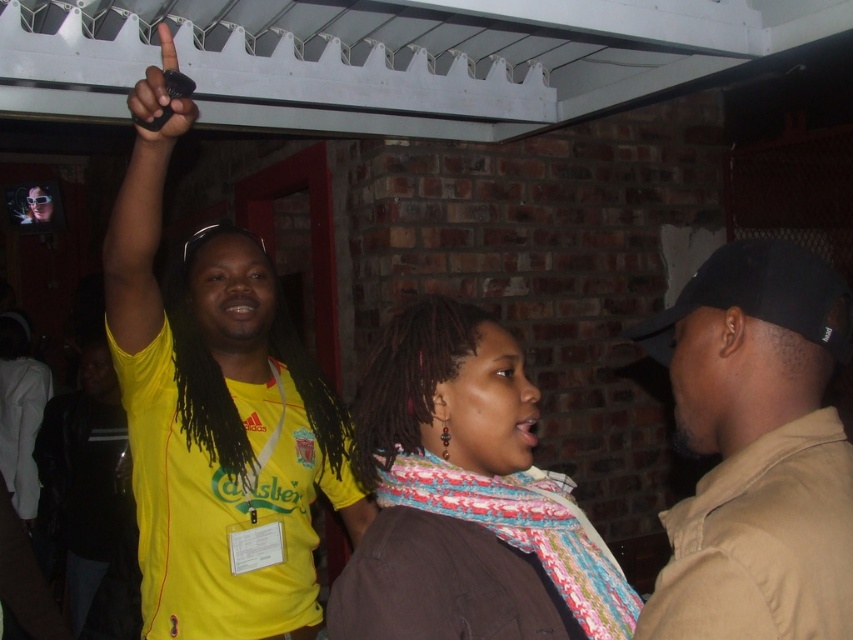
Question: Observing the image, what is the correct spatial positioning of black cotton cap at upper right in reference to black matte phone at upper left?

Choices:
 (A) left
 (B) right

Answer: (B)

Question: Which of the following is the farthest from the observer?

Choices:
 (A) (825, 460)
 (B) (175, 80)
 (C) (471, 369)
 (D) (283, 317)

Answer: (D)

Question: Does yellow jersey at upper left lie behind black matte phone at upper left?

Choices:
 (A) yes
 (B) no

Answer: (A)

Question: Which object is closer to the camera taking this photo?

Choices:
 (A) multicolored scarf at center
 (B) yellow jersey at upper left
 (C) black cotton cap at upper right
 (D) black matte phone at upper left

Answer: (C)

Question: Which object appears closest to the camera in this image?

Choices:
 (A) black cotton cap at upper right
 (B) multicolored scarf at center
 (C) yellow jersey at upper left
 (D) black matte phone at upper left

Answer: (A)

Question: Is multicolored scarf at center below black cotton cap at upper right?

Choices:
 (A) yes
 (B) no

Answer: (A)